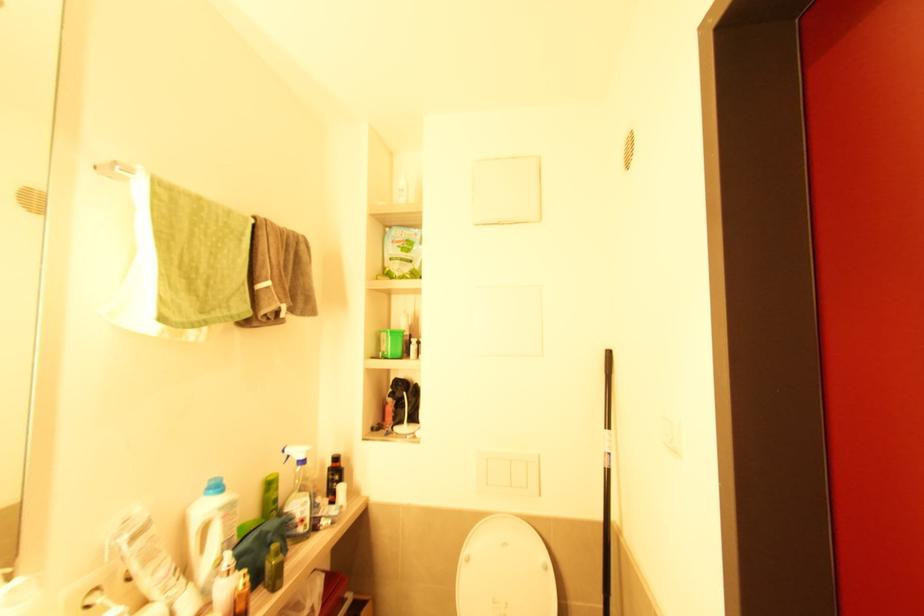
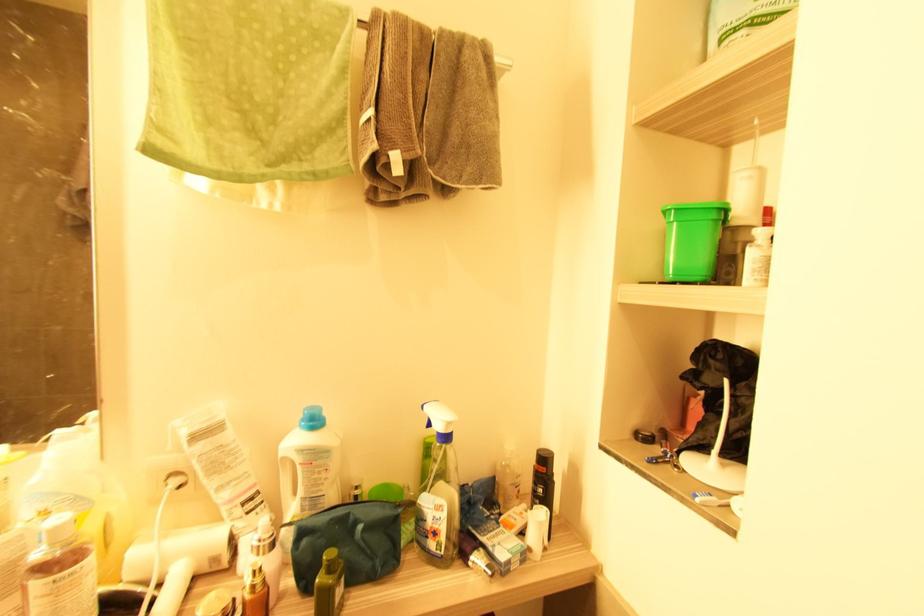
Find the pixel in the second image that matches the point at 298,527 in the first image.

(429, 539)